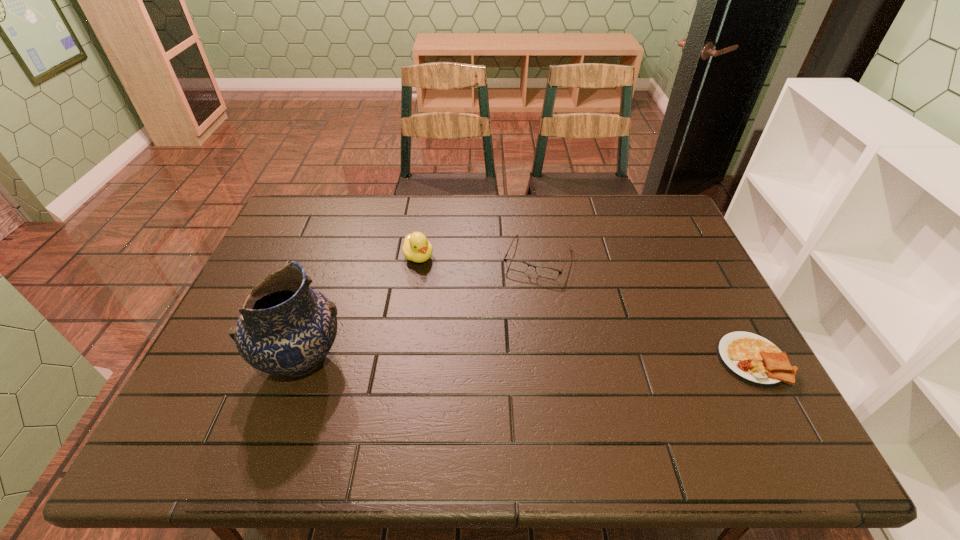
Where is `vacant region located 0.240m on the beak of the third shortest object`? This screenshot has height=540, width=960. vacant region located 0.240m on the beak of the third shortest object is located at coordinates (463, 319).

In order to click on vacant space located on the beak of the third shortest object in this screenshot , I will do click(461, 316).

Locate an element on the screen. free spot located on the beak of the third shortest object is located at coordinates (454, 307).

Find the location of a particular element. This screenshot has width=960, height=540. vacant space located 0.110m on the front-facing side of the second shortest object is located at coordinates (518, 307).

Where is `free space located on the front-facing side of the second shortest object`? The height and width of the screenshot is (540, 960). free space located on the front-facing side of the second shortest object is located at coordinates (495, 364).

The height and width of the screenshot is (540, 960). I want to click on free region located on the front-facing side of the second shortest object, so click(x=516, y=312).

I want to click on pottery located at the near edge, so [x=285, y=328].

Locate an element on the screen. Image resolution: width=960 pixels, height=540 pixels. omelet present at the near edge is located at coordinates (751, 358).

Image resolution: width=960 pixels, height=540 pixels. What are the coordinates of `object that is at the left edge` in the screenshot? It's located at (285, 328).

Find the location of a particular element. object located in the right edge section of the desktop is located at coordinates (751, 358).